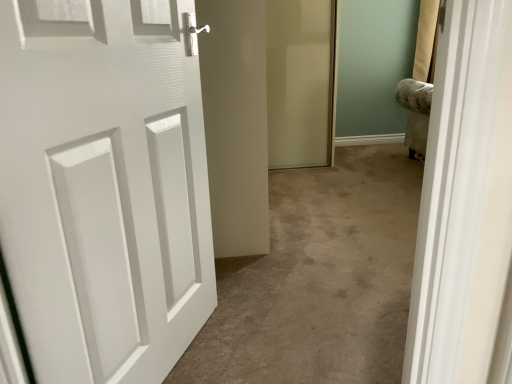
Measure the distance between translucent glass screen door at center and camera.

The depth of translucent glass screen door at center is 2.86 meters.

The width and height of the screenshot is (512, 384). What do you see at coordinates (300, 82) in the screenshot?
I see `translucent glass screen door at center` at bounding box center [300, 82].

Locate an element on the screen. This screenshot has height=384, width=512. translucent glass screen door at center is located at coordinates (300, 82).

Image resolution: width=512 pixels, height=384 pixels. Describe the element at coordinates (104, 185) in the screenshot. I see `white matte door at left` at that location.

Measure the distance between white matte door at left and camera.

white matte door at left is 26.61 inches away from camera.

Where is `white matte door at left`? This screenshot has width=512, height=384. white matte door at left is located at coordinates (104, 185).

Locate an element on the screen. translucent glass screen door at center is located at coordinates (300, 82).

Which is more to the right, translucent glass screen door at center or white matte door at left?

From the viewer's perspective, translucent glass screen door at center appears more on the right side.

Is translucent glass screen door at center in front of or behind white matte door at left in the image?

Visually, translucent glass screen door at center is located behind white matte door at left.

Between point (322, 133) and point (10, 232), which one is positioned behind?

The point (322, 133) is farther from the camera.

From the image's perspective, is translucent glass screen door at center beneath white matte door at left?

No.

From a real-world perspective, is translucent glass screen door at center located beneath white matte door at left?

Incorrect, from a real-world perspective, translucent glass screen door at center is higher than white matte door at left.

Between translucent glass screen door at center and white matte door at left, which one has larger width?

With larger width is translucent glass screen door at center.

Is translucent glass screen door at center shorter than white matte door at left?

No.

Is translucent glass screen door at center bigger or smaller than white matte door at left?

Considering their sizes, translucent glass screen door at center takes up more space than white matte door at left.

Would you say translucent glass screen door at center is outside white matte door at left?

translucent glass screen door at center lies outside white matte door at left's area.

Would you say translucent glass screen door at center is a long distance from white matte door at left?

Absolutely, translucent glass screen door at center is distant from white matte door at left.

Is translucent glass screen door at center facing away from white matte door at left?

No.

How far apart are translucent glass screen door at center and white matte door at left?

They are 2.06 meters apart.

The image size is (512, 384). I want to click on screen door to the right of white matte door at left, so click(300, 82).

Between white matte door at left and translucent glass screen door at center, which one appears on the left side from the viewer's perspective?

From the viewer's perspective, white matte door at left appears more on the left side.

Does white matte door at left come behind translucent glass screen door at center?

No.

Is point (163, 149) in front of point (327, 155)?

Yes, it is in front of point (327, 155).

From the image's perspective, which object appears higher, white matte door at left or translucent glass screen door at center?

translucent glass screen door at center, from the image's perspective.

From a real-world perspective, who is located higher, white matte door at left or translucent glass screen door at center?

translucent glass screen door at center, from a real-world perspective.

Is white matte door at left thinner than translucent glass screen door at center?

Indeed, white matte door at left has a lesser width compared to translucent glass screen door at center.

Does white matte door at left have a greater height compared to translucent glass screen door at center?

Incorrect, the height of white matte door at left is not larger of that of translucent glass screen door at center.

Considering the sizes of objects white matte door at left and translucent glass screen door at center in the image provided, who is bigger, white matte door at left or translucent glass screen door at center?

Bigger between the two is translucent glass screen door at center.

Is white matte door at left inside the boundaries of translucent glass screen door at center, or outside?

The correct answer is: outside.

Is white matte door at left with translucent glass screen door at center?

No, white matte door at left is not touching translucent glass screen door at center.

Is white matte door at left positioned with its back to translucent glass screen door at center?

No, white matte door at left is not facing the opposite direction of translucent glass screen door at center.

Can you tell me how much white matte door at left and translucent glass screen door at center differ in facing direction?

white matte door at left and translucent glass screen door at center are facing 67.3 degrees away from each other.

The width and height of the screenshot is (512, 384). What are the coordinates of `screen door above the white matte door at left (from a real-world perspective)` in the screenshot? It's located at (300, 82).

At what (x,y) coordinates should I click in order to perform the action: click on door below the translucent glass screen door at center (from a real-world perspective). Please return your answer as a coordinate pair (x, y). Image resolution: width=512 pixels, height=384 pixels. Looking at the image, I should click on (104, 185).

Where is `screen door above the white matte door at left (from a real-world perspective)`? This screenshot has width=512, height=384. screen door above the white matte door at left (from a real-world perspective) is located at coordinates (300, 82).